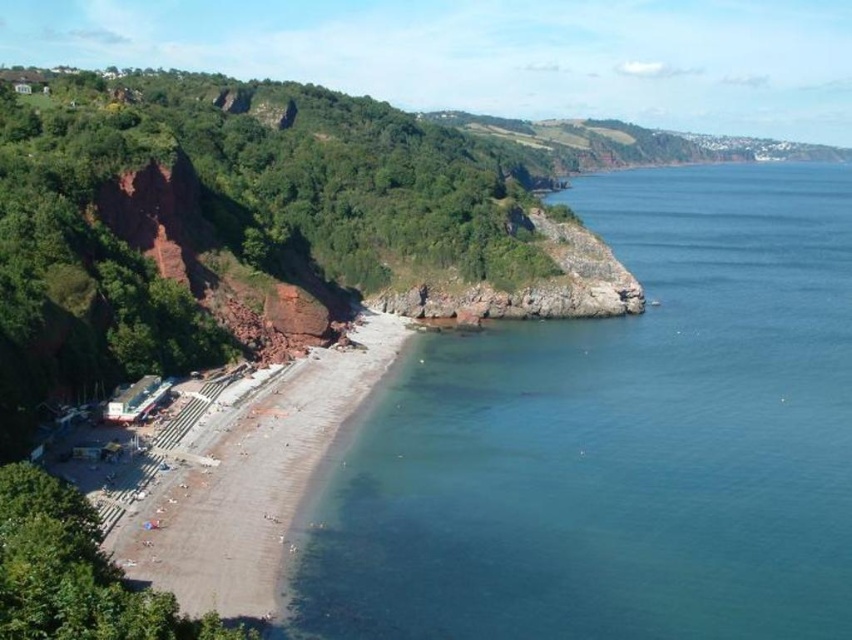
Which is more to the right, clear blue water at lower left or brown sandy beach at lower left?

clear blue water at lower left

Is point (515, 474) positioned before point (235, 502)?

That is False.

The width and height of the screenshot is (852, 640). I want to click on clear blue water at lower left, so click(x=619, y=442).